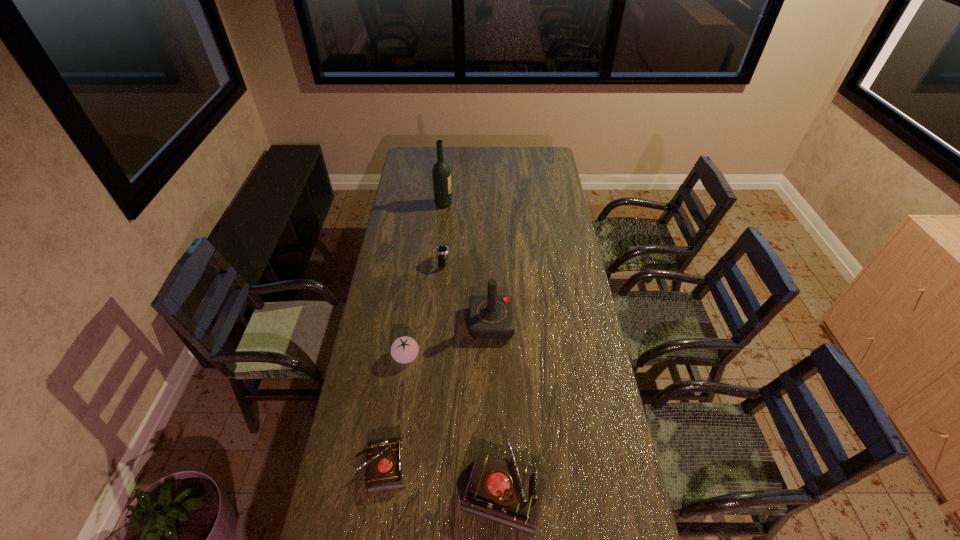
The height and width of the screenshot is (540, 960). Find the location of `the left diary`. the left diary is located at coordinates (385, 463).

The image size is (960, 540). Find the location of `the shorter diary`. the shorter diary is located at coordinates 385,463.

Find the location of a particular element. This screenshot has height=540, width=960. the right diary is located at coordinates (501, 490).

Identify the location of wine bottle. (441, 173).

What are the coordinates of `the tallest object` in the screenshot? It's located at (441, 173).

Find the location of `the second farthest object`. the second farthest object is located at coordinates (441, 251).

Identify the location of the fourth nearest object. (491, 316).

Where is `joystick`? This screenshot has height=540, width=960. joystick is located at coordinates (491, 316).

Locate an element on the screen. This screenshot has width=960, height=540. tomato is located at coordinates (405, 349).

At what (x,y) coordinates should I click in order to perform the action: click on vacant position located on the back of the left diary. Please return your answer as a coordinate pair (x, y). Image resolution: width=960 pixels, height=540 pixels. Looking at the image, I should click on (399, 359).